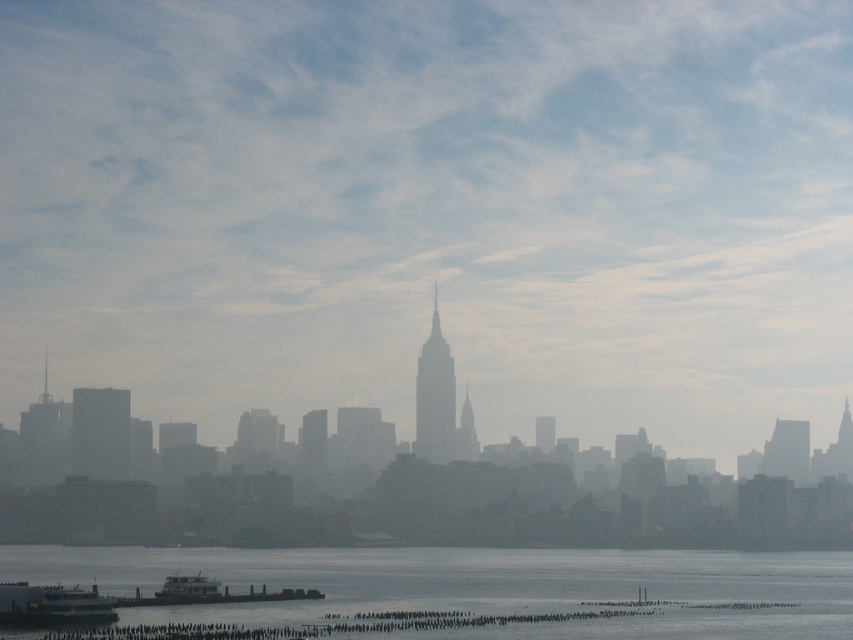
Can you confirm if transparent foggy skyline at center is bigger than metallic gray ferry at lower center?

Yes.

Does transparent foggy skyline at center appear on the left side of metallic gray ferry at lower center?

No, transparent foggy skyline at center is not to the left of metallic gray ferry at lower center.

Measure the distance between transparent foggy skyline at center and camera.

transparent foggy skyline at center and camera are 639.15 meters apart.

Find the location of `transparent foggy skyline at center`. transparent foggy skyline at center is located at coordinates (432, 211).

Does clear water at lower center have a lesser width compared to white glossy ferry at lower left?

No, clear water at lower center is not thinner than white glossy ferry at lower left.

Does clear water at lower center have a greater width compared to white glossy ferry at lower left?

Correct, the width of clear water at lower center exceeds that of white glossy ferry at lower left.

What do you see at coordinates (483, 588) in the screenshot?
I see `clear water at lower center` at bounding box center [483, 588].

The height and width of the screenshot is (640, 853). What are the coordinates of `clear water at lower center` in the screenshot? It's located at (483, 588).

Does transparent foggy skyline at center have a smaller size compared to white matte ferry at lower left?

Incorrect, transparent foggy skyline at center is not smaller in size than white matte ferry at lower left.

Does transparent foggy skyline at center come in front of white matte ferry at lower left?

Yes.

Image resolution: width=853 pixels, height=640 pixels. In order to click on transparent foggy skyline at center in this screenshot , I will do `click(432, 211)`.